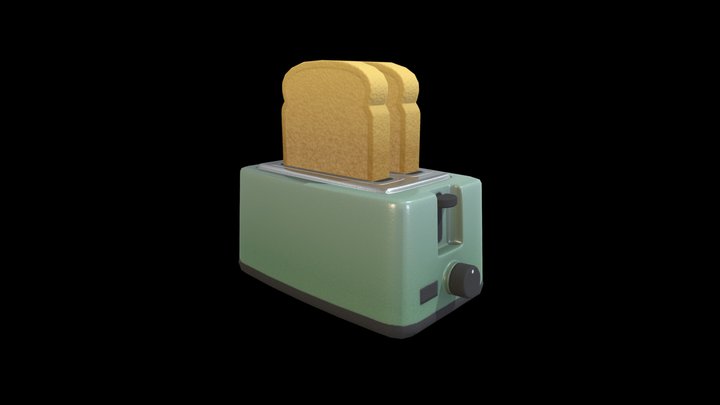
At what (x,y) coordinates should I click in order to perform the action: click on toaster. Please return your answer as a coordinate pair (x, y). This screenshot has width=720, height=405. Looking at the image, I should click on (338, 244).